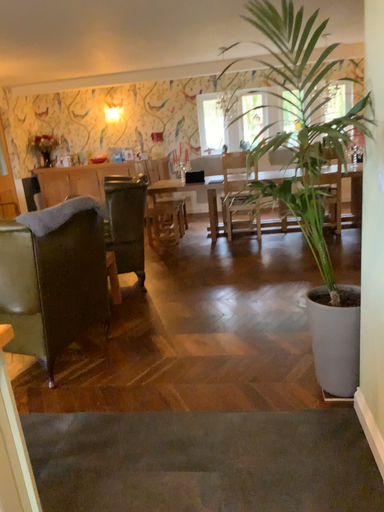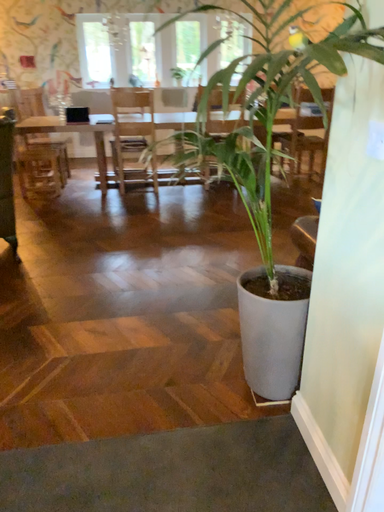
Question: Which way did the camera rotate in the video?

Choices:
 (A) rotated downward
 (B) rotated upward

Answer: (A)